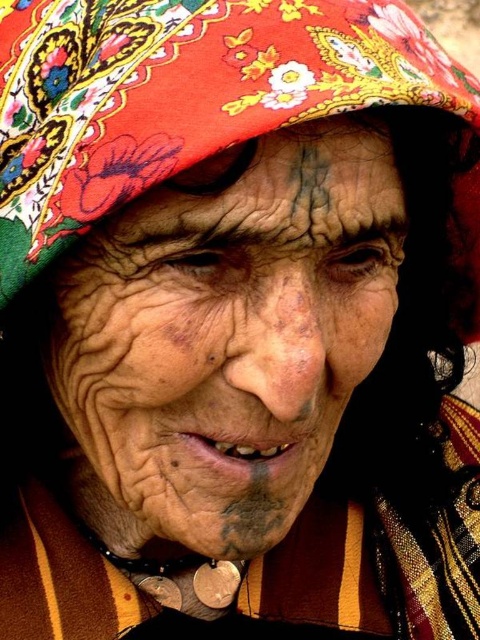
Question: Considering the real-world distances, which object is closest to the striped woolen robe at lower center?

Choices:
 (A) floral fabric headdress at upper center
 (B) dry skin at center
 (C) dark skin forehead at upper center

Answer: (B)

Question: Does dry skin at center have a lesser width compared to striped woolen robe at lower center?

Choices:
 (A) no
 (B) yes

Answer: (B)

Question: Estimate the real-world distances between objects in this image. Which object is farther from the floral fabric headdress at upper center?

Choices:
 (A) striped woolen robe at lower center
 (B) dark skin forehead at upper center

Answer: (A)

Question: Is dry skin at center smaller than floral fabric headdress at upper center?

Choices:
 (A) no
 (B) yes

Answer: (B)

Question: In this image, where is dry skin at center located relative to floral fabric headdress at upper center?

Choices:
 (A) left
 (B) right

Answer: (A)

Question: Which is nearer to the dark skin forehead at upper center?

Choices:
 (A) floral fabric headdress at upper center
 (B) striped woolen robe at lower center

Answer: (A)